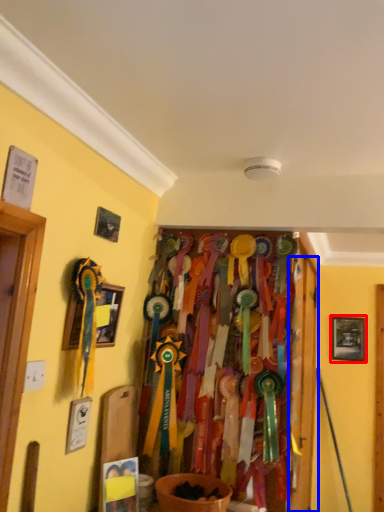
Question: Which point is further to the camera, picture frame (highlighted by a red box) or door (highlighted by a blue box)?

Choices:
 (A) picture frame
 (B) door

Answer: (A)